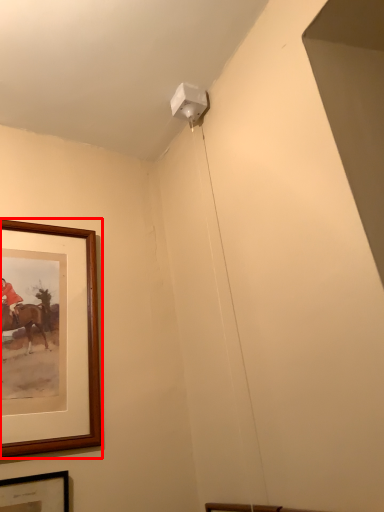
Question: From the image's perspective, where is picture frame (annotated by the red box) located relative to picture frame?

Choices:
 (A) below
 (B) above

Answer: (B)